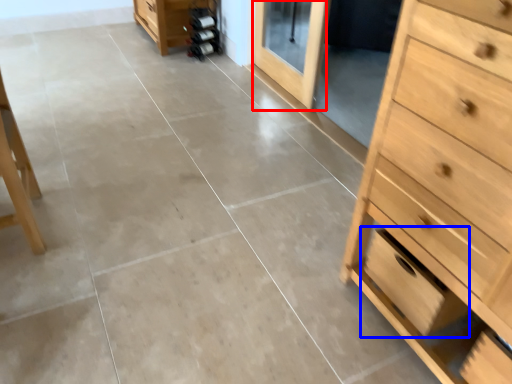
Question: Which object is closer to the camera taking this photo, screen door (highlighted by a red box) or drawer (highlighted by a blue box)?

Choices:
 (A) screen door
 (B) drawer

Answer: (B)